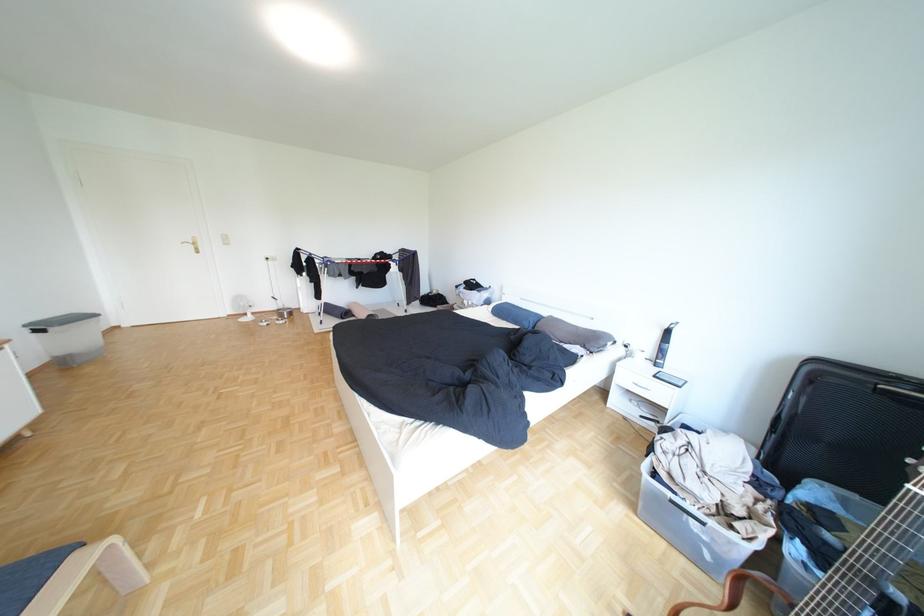
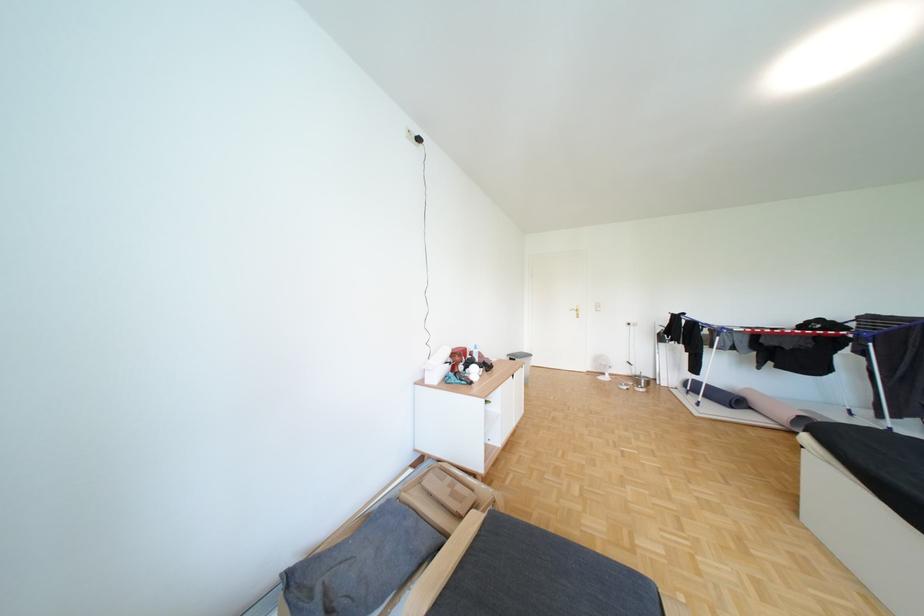
Question: How did the camera likely rotate?

Choices:
 (A) Left
 (B) Right
 (C) Up
 (D) Down

Answer: (A)